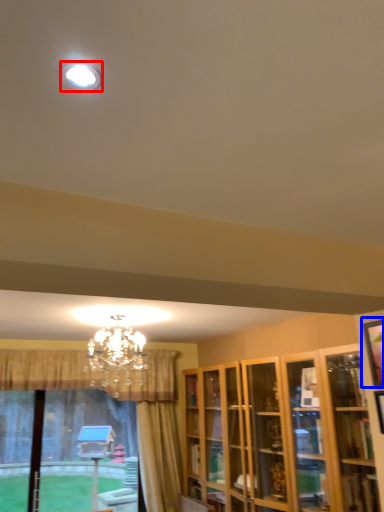
Question: Which point is closer to the camera, lighting (highlighted by a red box) or picture frame (highlighted by a blue box)?

Choices:
 (A) lighting
 (B) picture frame

Answer: (A)